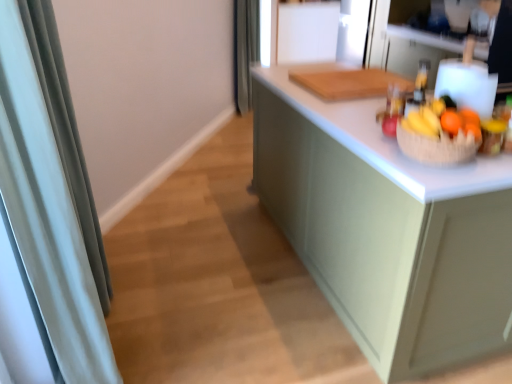
Question: Is translucent glass bottle at upper right in front of or behind satin fabric shower curtain at left, placed as the second shower curtain when sorted from back to front, in the image?

Choices:
 (A) behind
 (B) front

Answer: (A)

Question: Is point (417, 82) positioned closer to the camera than point (32, 109)?

Choices:
 (A) closer
 (B) farther

Answer: (B)

Question: Estimate the real-world distances between objects in this image. Which object is farther from the matte green cabinet at center?

Choices:
 (A) translucent glass bottle at upper right
 (B) satin fabric shower curtain at left, the second shower curtain positioned from the right
 (C) brown woven basket at right
 (D) orange matte at right
 (E) gray fabric shower curtain at upper center, which is the 2th shower curtain from front to back

Answer: (E)

Question: Which object is positioned closest to the gray fabric shower curtain at upper center, marked as the 2th shower curtain in a left-to-right arrangement?

Choices:
 (A) satin fabric shower curtain at left, which is the first shower curtain in bottom-to-top order
 (B) translucent glass bottle at upper right
 (C) brown woven basket at right
 (D) matte green cabinet at center
 (E) orange matte at right

Answer: (D)